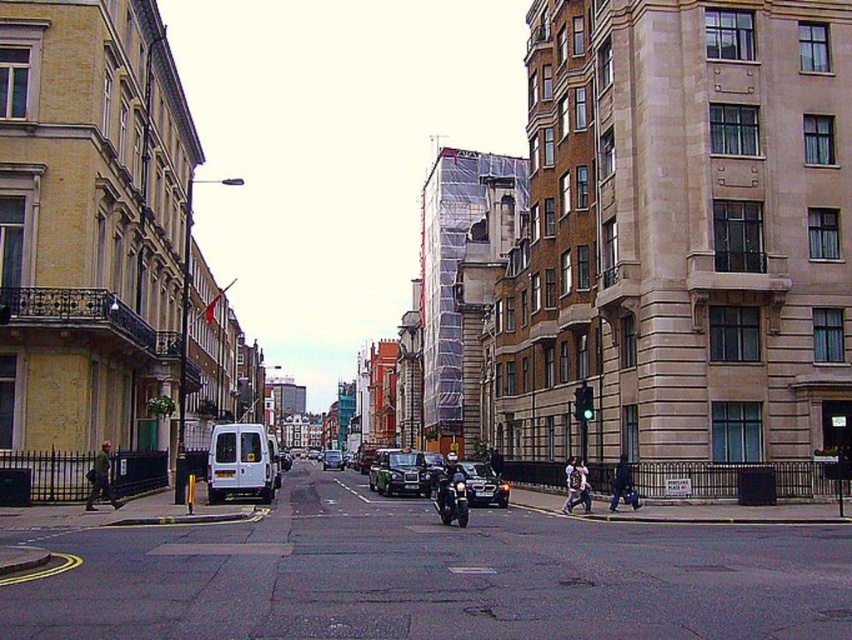
Which of these two, dark gray jacket at left or matte black car at center, stands taller?

Standing taller between the two is matte black car at center.

Is point (91, 492) positioned before point (340, 451)?

Yes, point (91, 492) is in front of point (340, 451).

Which is behind, point (113, 499) or point (323, 465)?

Positioned behind is point (323, 465).

Find the location of a particular element. dark gray jacket at left is located at coordinates (101, 480).

Between black metallic car at center and light brown leather jacket at center, which one has less height?

Standing shorter between the two is light brown leather jacket at center.

Is black metallic car at center to the right of light brown leather jacket at center from the viewer's perspective?

No, black metallic car at center is not to the right of light brown leather jacket at center.

Between point (373, 467) and point (567, 492), which one is positioned in front?

Point (567, 492)

What are the coordinates of `black metallic car at center` in the screenshot? It's located at (484, 484).

Is black metallic car at center closer to the viewer compared to metallic silver car at center?

Yes, black metallic car at center is in front of metallic silver car at center.

Is point (366, 474) positioned in front of point (409, 451)?

No.

Is point (494, 502) closer to viewer compared to point (387, 458)?

Yes, it is.

Identify the location of black metallic car at center. (484, 484).